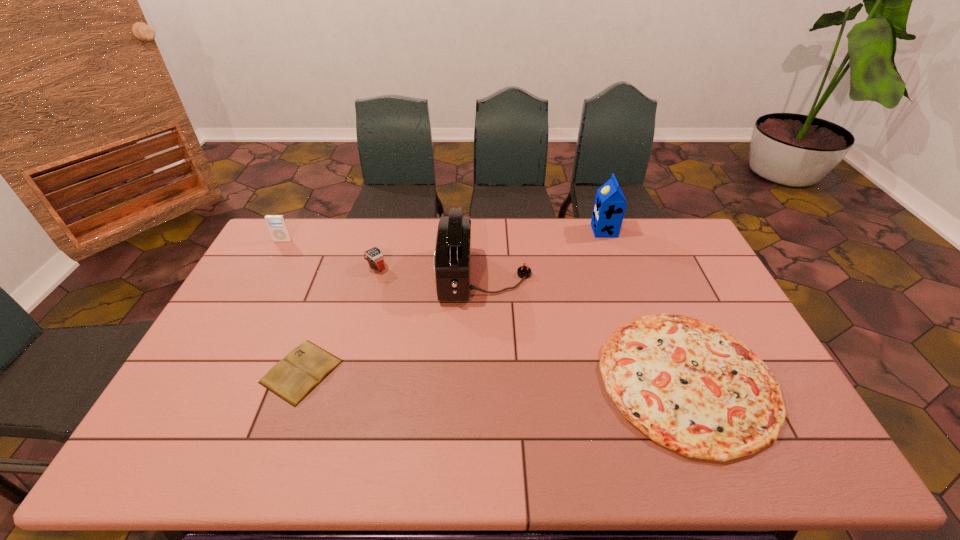
In order to click on free space located 0.110m on the front-facing side of the third object from right to left in this screenshot , I will do `click(405, 276)`.

The image size is (960, 540). Find the location of `free space located on the front-facing side of the third object from right to left`. free space located on the front-facing side of the third object from right to left is located at coordinates (344, 276).

At what (x,y) coordinates should I click in order to perform the action: click on vacant region located on the front-facing side of the third object from right to left. Please return your answer as a coordinate pair (x, y). Looking at the image, I should click on (349, 276).

You are a GUI agent. You are given a task and a screenshot of the screen. Output one action in this format:
    pyautogui.click(x=<x>, y=<y>)
    Task: Click on the blank space located 0.080m on the front-facing side of the iPod
    The height and width of the screenshot is (540, 960).
    Given the screenshot: What is the action you would take?
    [x=275, y=256]

Identify the location of free space located 0.120m on the right of the watch. (421, 267).

Where is `vacant space located on the back of the second shortest object`? This screenshot has width=960, height=540. vacant space located on the back of the second shortest object is located at coordinates (653, 296).

Locate an element on the screen. free region located 0.120m on the back of the shortest object is located at coordinates (324, 310).

I want to click on carton that is at the far edge, so click(610, 204).

Image resolution: width=960 pixels, height=540 pixels. Find the location of `radio receiver present at the far edge`. radio receiver present at the far edge is located at coordinates (452, 256).

The width and height of the screenshot is (960, 540). What are the coordinates of `iPod that is at the far edge` in the screenshot? It's located at (277, 225).